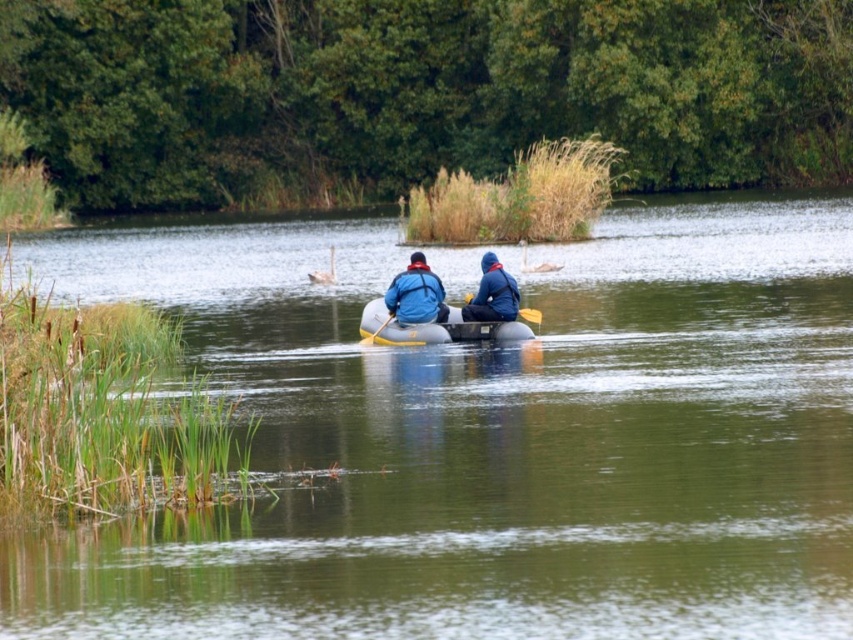
You are a photographer trying to capture both the blue fabric jacket at center and the blue matte jacket at center in the same frame. Which jacket should you focus on first to ensure both are in focus?

You should focus on the blue fabric jacket at center first because it is closer to you than the blue matte jacket at center, ensuring both will be in focus when using depth of field.

You are a photographer trying to capture the green rubber raft at center and the blue fabric jacket at center in the same frame. Based on their positions, can you tell which object is closer to the camera?

The green rubber raft at center is above the blue fabric jacket at center, meaning it is closer to the camera.

Based on the photo, you are navigating a small inflatable raft with two people on it. You need to reach a destination point located at point (421, 305). Your current position is at point (482, 268). Based on the scene description, which direction should you paddle to move towards the destination point?

Since point (421, 305) is in front of point (482, 268), you should paddle forward to move towards the destination point.